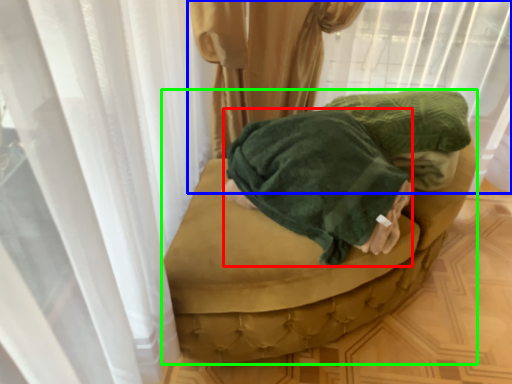
Question: Which is farther away from clothing (highlighted by a red box)? curtain (highlighted by a blue box) or furniture (highlighted by a green box)?

Choices:
 (A) curtain
 (B) furniture

Answer: (A)